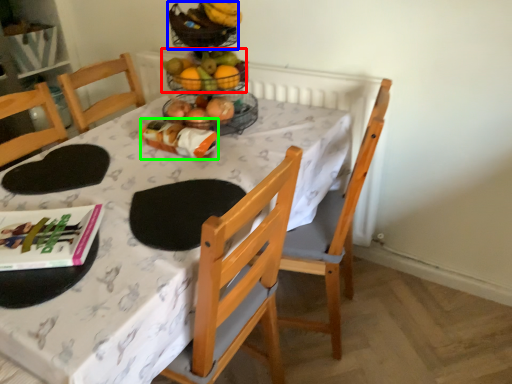
Question: Which object is positioned closest to grapefruit (highlighted by a red box)? Select from basket (highlighted by a blue box) and food (highlighted by a green box).

Choices:
 (A) basket
 (B) food

Answer: (A)